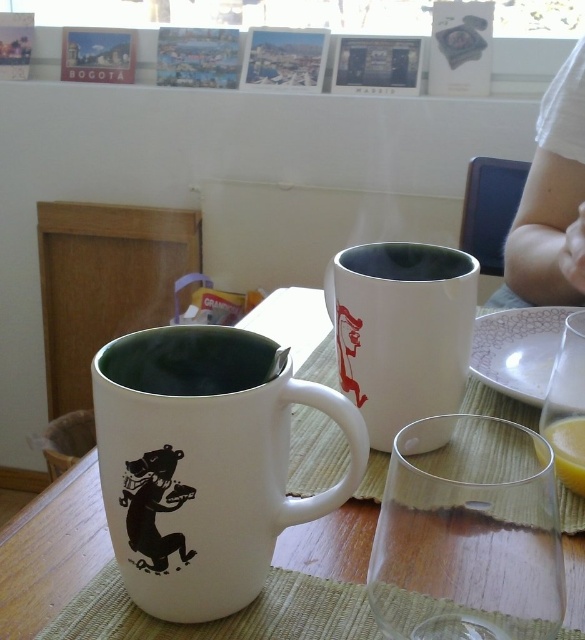
Is transparent glass at center bigger than white ceramic mug at upper center?

Actually, transparent glass at center might be smaller than white ceramic mug at upper center.

Which of these two, transparent glass at center or white ceramic mug at upper center, stands shorter?

transparent glass at center is shorter.

Is point (494, 524) closer to camera compared to point (345, 268)?

Yes.

Identify the location of transparent glass at center. The height and width of the screenshot is (640, 585). (468, 532).

Is porcelain plate at upper right thinner than translucent glass at lower right?

No.

Who is shorter, porcelain plate at upper right or translucent glass at lower right?

translucent glass at lower right is shorter.

What do you see at coordinates (517, 349) in the screenshot? I see `porcelain plate at upper right` at bounding box center [517, 349].

Locate an element on the screen. porcelain plate at upper right is located at coordinates (517, 349).

Measure the distance between transparent glass at center and white matte cup at center.

transparent glass at center and white matte cup at center are 7.07 inches apart from each other.

Does point (490, 488) come behind point (459, 257)?

No, (490, 488) is in front of (459, 257).

Locate an element on the screen. This screenshot has width=585, height=640. transparent glass at center is located at coordinates (468, 532).